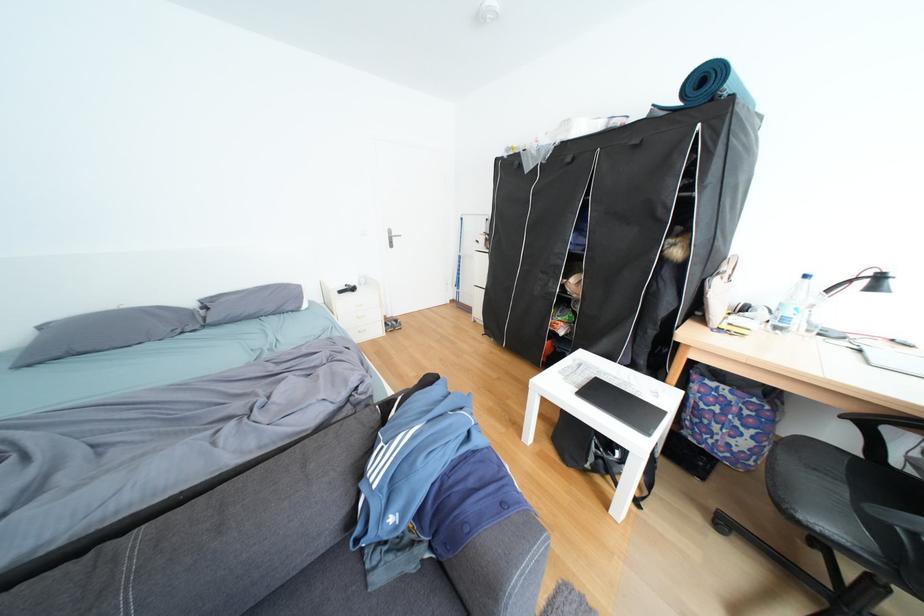
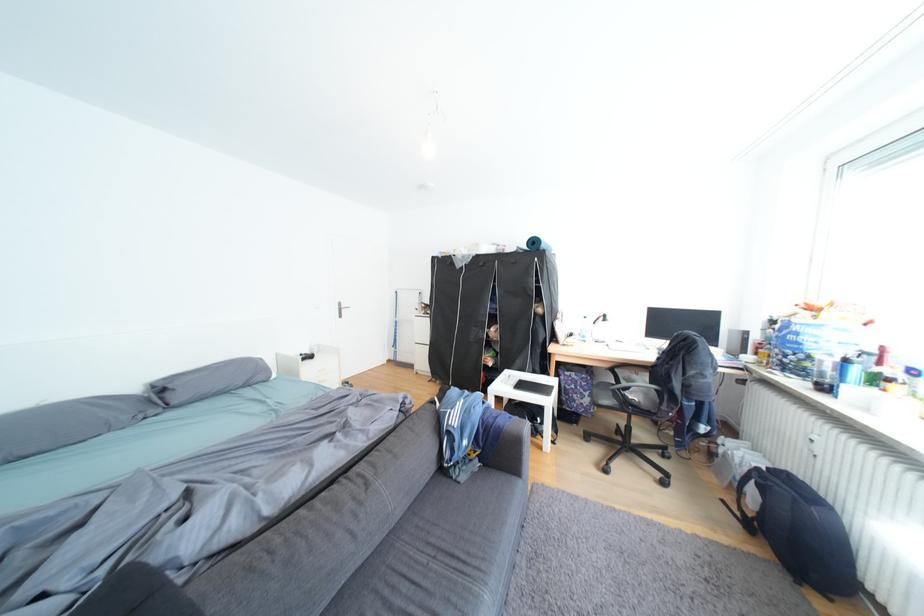
Find the pixel in the second image that matches the point at 575,334 in the first image.

(504, 365)